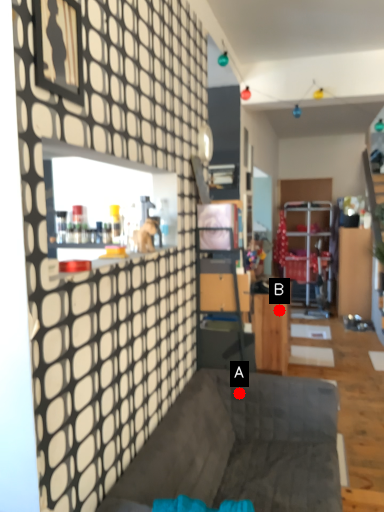
Question: Two points are circled on the image, labeled by A and B beside each circle. Which point is farther from the camera taking this photo?

Choices:
 (A) A is further
 (B) B is further

Answer: (B)